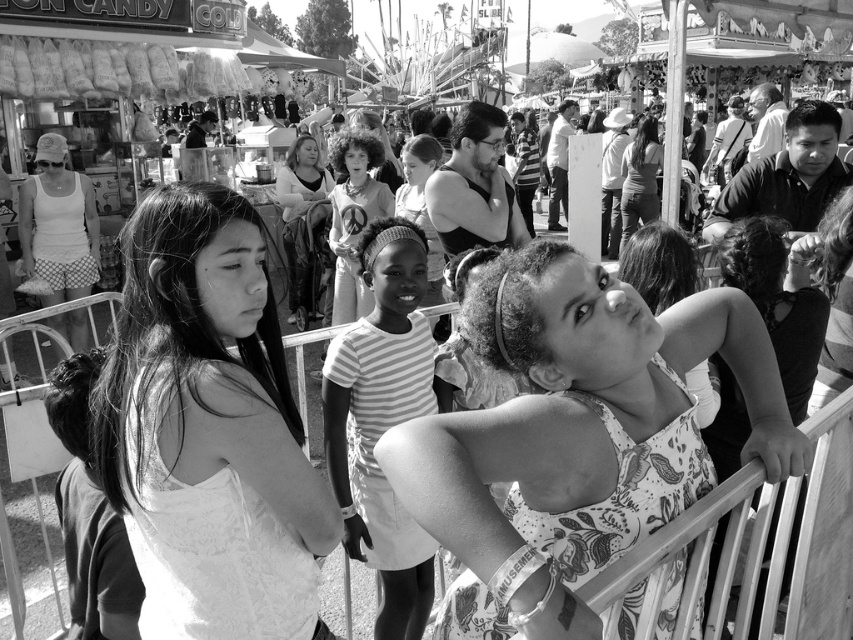
You are a photographer trying to capture the perfect shot of the two girls in the center of the image. The girls are wearing a white lace dress at center and a matte gray tank top at upper center. Which girl should you focus on if you want to photograph the one closer to the left side?

The white lace dress at center is to the left of the matte gray tank top at upper center, so you should focus on the girl wearing the white lace dress at center.

You are a photographer aiming to capture a candid shot of the two girls wearing the floral print tank top at center and the matte black dress at center. Since you want to ensure both subjects are fully visible in the frame, which girl should you position closer to the camera to avoid cropping their outfits?

The floral print tank top at center is shorter than the matte black dress at center, so you should position the girl wearing the floral print tank top at center closer to the camera to ensure her outfit is fully visible without being cropped by the frame.

You are a photographer trying to capture the middle girl in the scene. You notice two striped patterns on her clothing. Which one, the striped fabric dress at center or the striped fabric shirt at center, is closer to the camera?

The striped fabric dress at center is positioned under the striped fabric shirt at center, so the striped fabric shirt at center is closer to the camera.